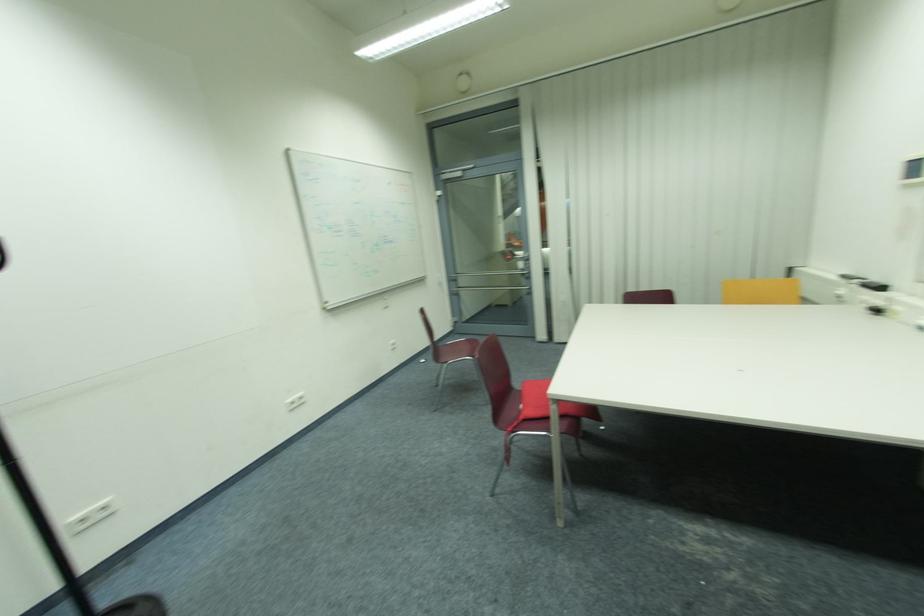
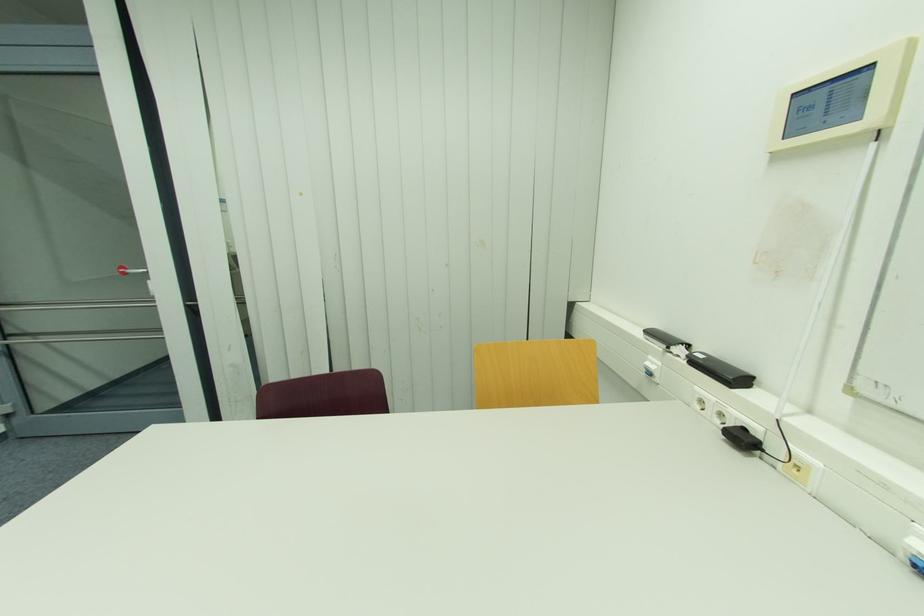
From the picture: In a continuous first-person perspective shot, in which direction is the camera moving?

The cameraman moved toward right, forward.